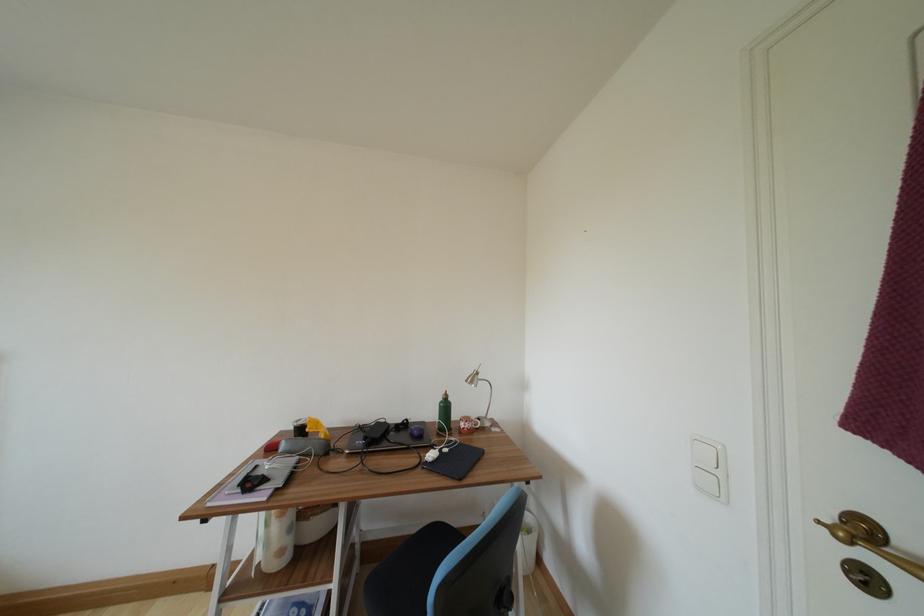
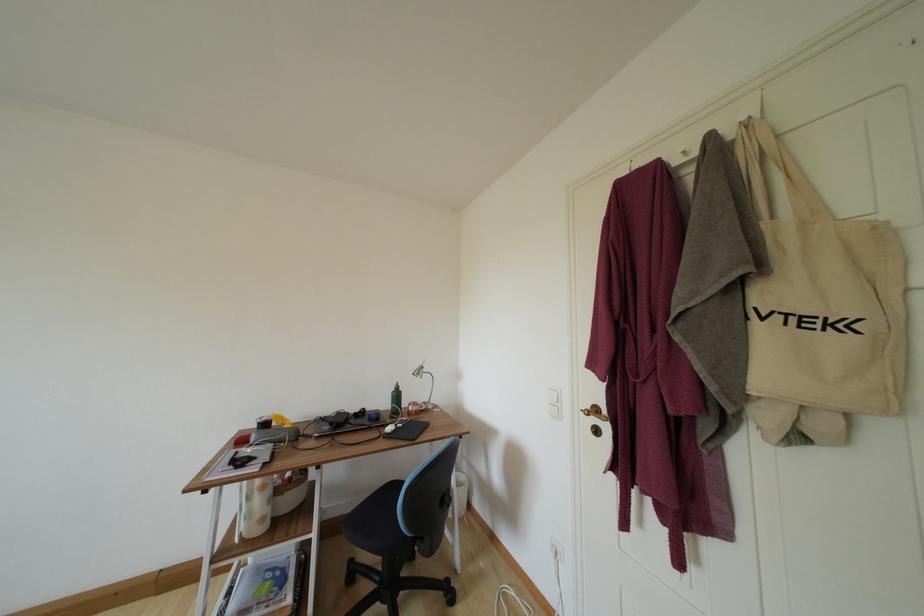
Locate, in the second image, the point that corresponds to (286,556) in the first image.

(266, 524)